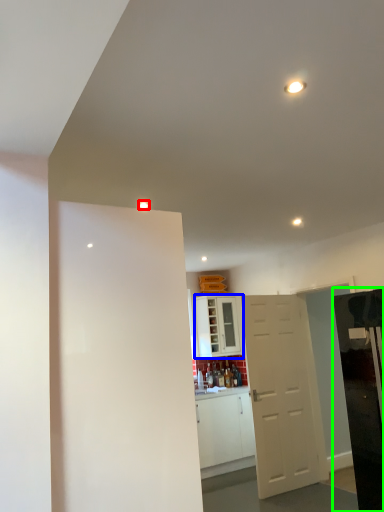
Question: Which object is the closest to the light (highlighted by a red box)? Choose among these: cabinetry (highlighted by a blue box) or appliance (highlighted by a green box).

Choices:
 (A) cabinetry
 (B) appliance

Answer: (B)